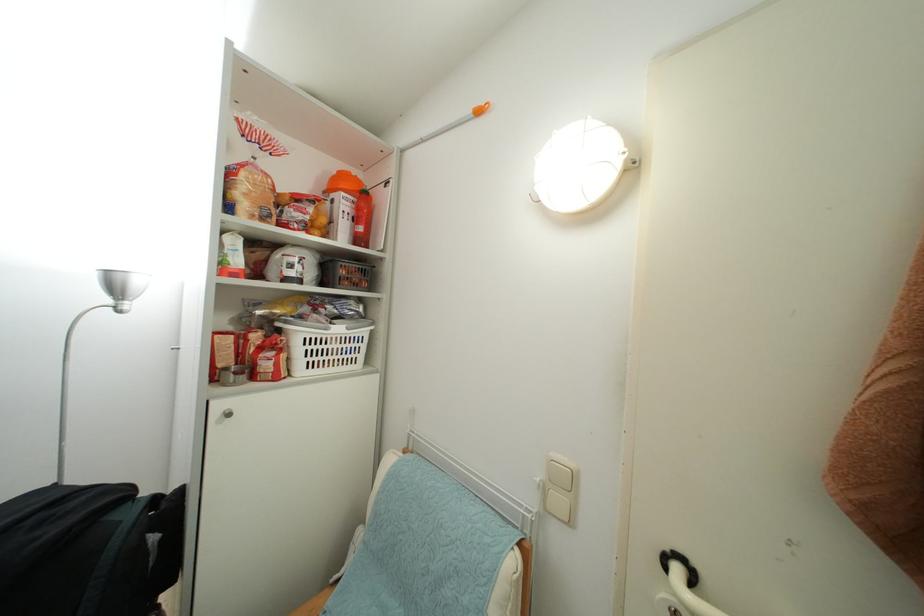
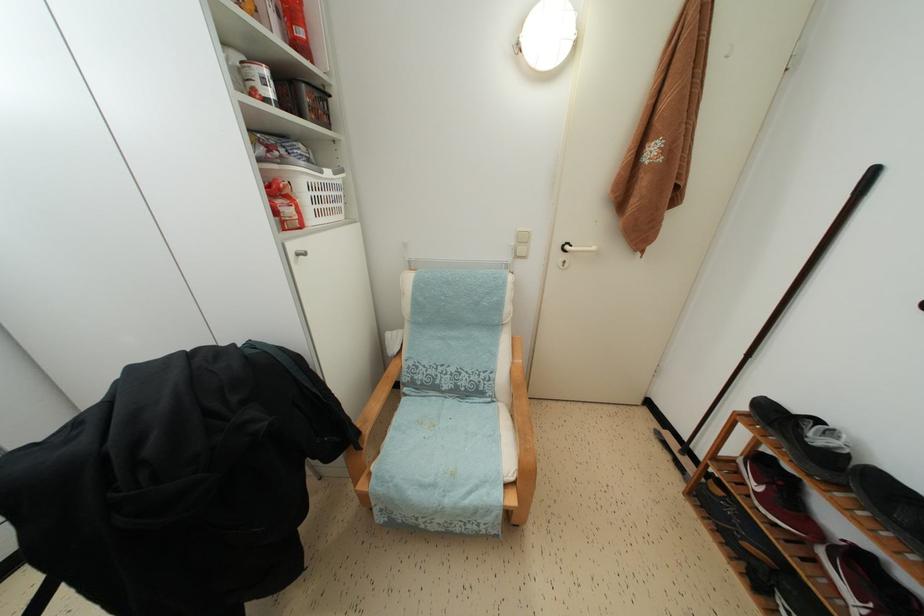
Based on the continuous images, in which direction is the camera rotating?

The rotation direction of the camera is right-down.